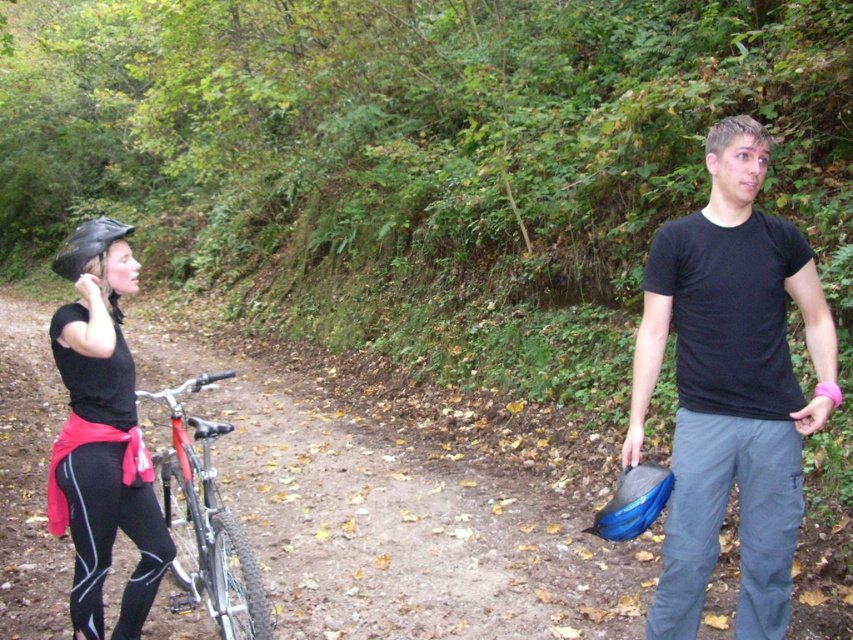
Looking at this image, is matte black helmet at left to the left of shiny metallic bicycle at left from the viewer's perspective?

Indeed, matte black helmet at left is positioned on the left side of shiny metallic bicycle at left.

Does matte black helmet at left appear over shiny metallic bicycle at left?

Yes, matte black helmet at left is above shiny metallic bicycle at left.

Locate an element on the screen. matte black helmet at left is located at coordinates (102, 435).

Locate an element on the screen. matte black helmet at left is located at coordinates (102, 435).

Is black matte t-shirt at right below shiny metallic bicycle at left?

No.

Who is more forward, (x=726, y=381) or (x=166, y=468)?

Positioned in front is point (x=726, y=381).

Which is behind, point (786, 609) or point (195, 428)?

The point (195, 428) is more distant.

I want to click on black matte t-shirt at right, so click(x=730, y=387).

What do you see at coordinates (730, 387) in the screenshot? I see `black matte t-shirt at right` at bounding box center [730, 387].

Does black matte t-shirt at right have a lesser width compared to matte black helmet at left?

Incorrect, black matte t-shirt at right's width is not less than matte black helmet at left's.

What do you see at coordinates (730, 387) in the screenshot?
I see `black matte t-shirt at right` at bounding box center [730, 387].

Locate an element on the screen. Image resolution: width=853 pixels, height=640 pixels. black matte t-shirt at right is located at coordinates (730, 387).